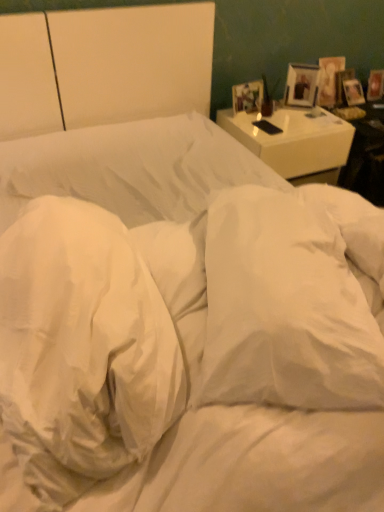
Question: Is matte wooden picture frame at upper right, which is counted as the third picture frame, starting from the back, not within white glossy nightstand at upper right?

Choices:
 (A) yes
 (B) no

Answer: (A)

Question: Is matte wooden picture frame at upper right, placed as the third picture frame when sorted from right to left, positioned in front of white glossy nightstand at upper right?

Choices:
 (A) no
 (B) yes

Answer: (A)

Question: Is matte wooden picture frame at upper right, which is the first picture frame from front to back, with white glossy nightstand at upper right?

Choices:
 (A) no
 (B) yes

Answer: (A)

Question: Is matte wooden picture frame at upper right, which is the first picture frame from front to back, wider than white glossy nightstand at upper right?

Choices:
 (A) no
 (B) yes

Answer: (A)

Question: From the image's perspective, does matte wooden picture frame at upper right, placed as the third picture frame when sorted from right to left, appear lower than white glossy nightstand at upper right?

Choices:
 (A) no
 (B) yes

Answer: (A)

Question: Considering the relative sizes of matte wooden picture frame at upper right, placed as the third picture frame when sorted from right to left, and white glossy nightstand at upper right in the image provided, is matte wooden picture frame at upper right, placed as the third picture frame when sorted from right to left, bigger than white glossy nightstand at upper right?

Choices:
 (A) yes
 (B) no

Answer: (B)

Question: From the image's perspective, is white glossy nightstand at upper right beneath white soft pillow at center, positioned as the 1th pillow in right-to-left order?

Choices:
 (A) yes
 (B) no

Answer: (B)

Question: Can you confirm if white glossy nightstand at upper right is positioned to the left of white soft pillow at center, marked as the 2th pillow in a left-to-right arrangement?

Choices:
 (A) no
 (B) yes

Answer: (A)

Question: Can you confirm if white glossy nightstand at upper right is taller than white soft pillow at center, positioned as the 1th pillow in right-to-left order?

Choices:
 (A) yes
 (B) no

Answer: (A)

Question: Is white glossy nightstand at upper right wider than white soft pillow at center, positioned as the 1th pillow in right-to-left order?

Choices:
 (A) no
 (B) yes

Answer: (B)

Question: Considering the relative positions of white glossy nightstand at upper right and white soft pillow at center, marked as the 2th pillow in a left-to-right arrangement, in the image provided, is white glossy nightstand at upper right to the right of white soft pillow at center, marked as the 2th pillow in a left-to-right arrangement, from the viewer's perspective?

Choices:
 (A) yes
 (B) no

Answer: (A)

Question: From a real-world perspective, is white glossy nightstand at upper right located higher than white soft pillow at center, positioned as the 1th pillow in right-to-left order?

Choices:
 (A) yes
 (B) no

Answer: (B)

Question: Does white glossy nightstand at upper right lie in front of matte wooden picture frame at upper right, which is the first picture frame from front to back?

Choices:
 (A) yes
 (B) no

Answer: (A)